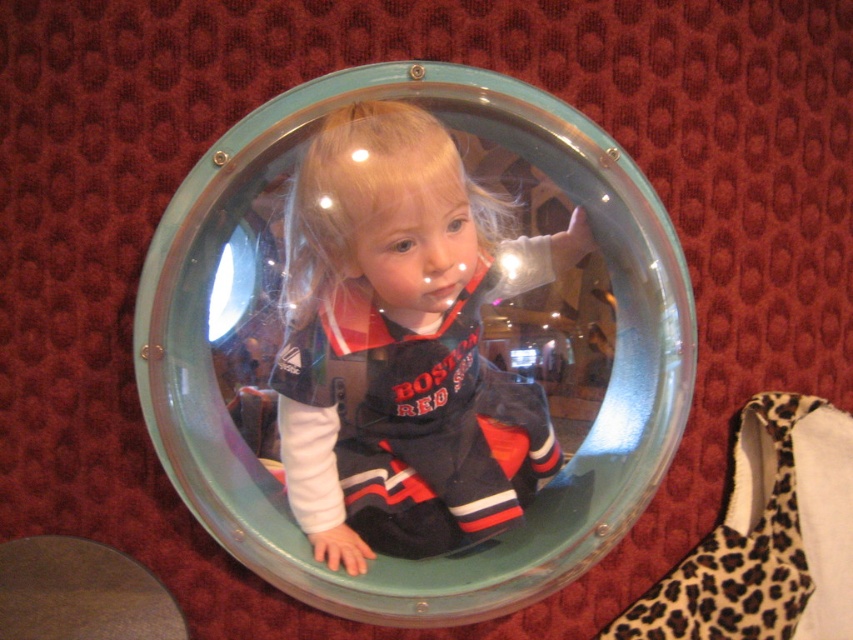
Is transparent plastic dome at center thinner than matte black astronaut suit at center?

No.

Is point (497, 102) positioned in front of point (469, 336)?

Yes, point (497, 102) is in front of point (469, 336).

Which is in front, point (631, 234) or point (378, 224)?

Point (378, 224)

At what (x,y) coordinates should I click in order to perform the action: click on transparent plastic dome at center. Please return your answer as a coordinate pair (x, y). This screenshot has height=640, width=853. Looking at the image, I should click on (561, 472).